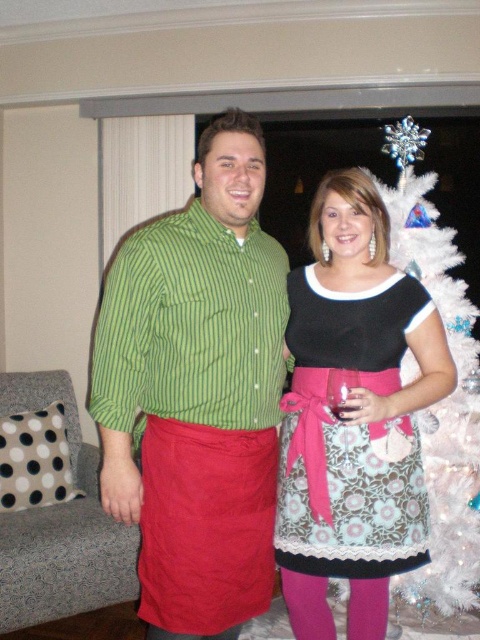
Question: Which of the following is the closest to the observer?

Choices:
 (A) (159, 413)
 (B) (359, 378)
 (C) (474, 550)
 (D) (388, 540)

Answer: (A)

Question: Which point is closer to the camera taking this photo?

Choices:
 (A) (288, 276)
 (B) (346, 444)
 (C) (149, 531)

Answer: (C)

Question: Does matte green striped shirt at center have a greater width compared to transparent glass at center?

Choices:
 (A) no
 (B) yes

Answer: (B)

Question: Does matte green striped shirt at center appear on the right side of transparent glass at center?

Choices:
 (A) yes
 (B) no

Answer: (B)

Question: Which point appears closest to the camera in this image?

Choices:
 (A) (302, 461)
 (B) (227, 193)
 (C) (427, 586)
 (D) (356, 436)

Answer: (B)

Question: Considering the relative positions of matte green striped shirt at center and transparent glass at center in the image provided, where is matte green striped shirt at center located with respect to transparent glass at center?

Choices:
 (A) above
 (B) below

Answer: (A)